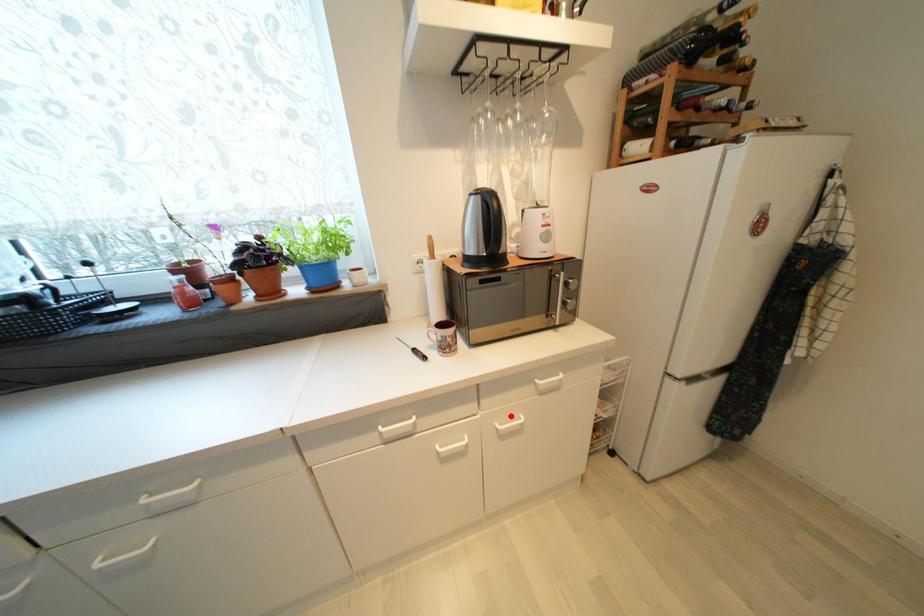
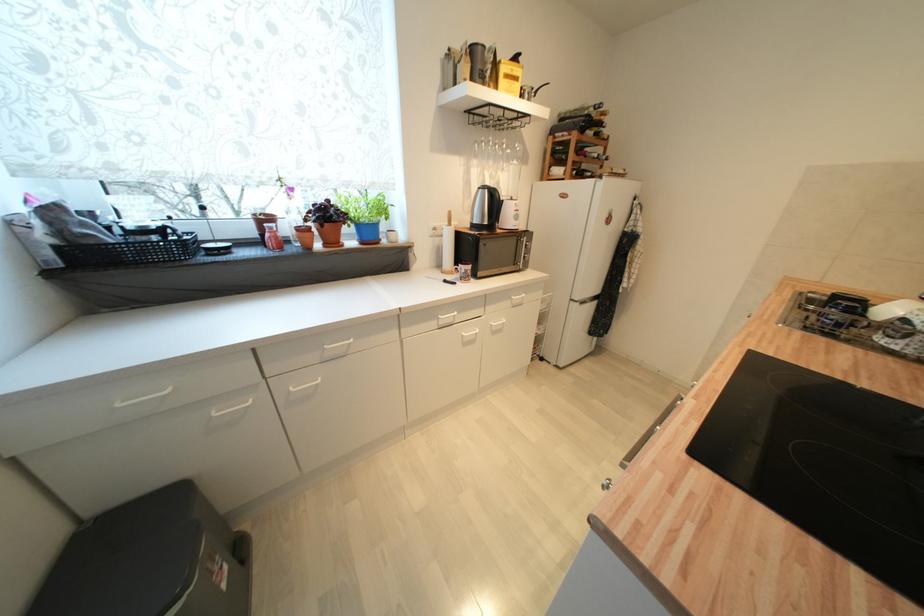
Question: I am providing you with two images of the same scene from different viewpoints. Image1 has a red point marked. In image2, the corresponding 3D location appears at what relative position? Reply with the corresponding letter.

Choices:
 (A) Closer
 (B) Farther

Answer: (A)